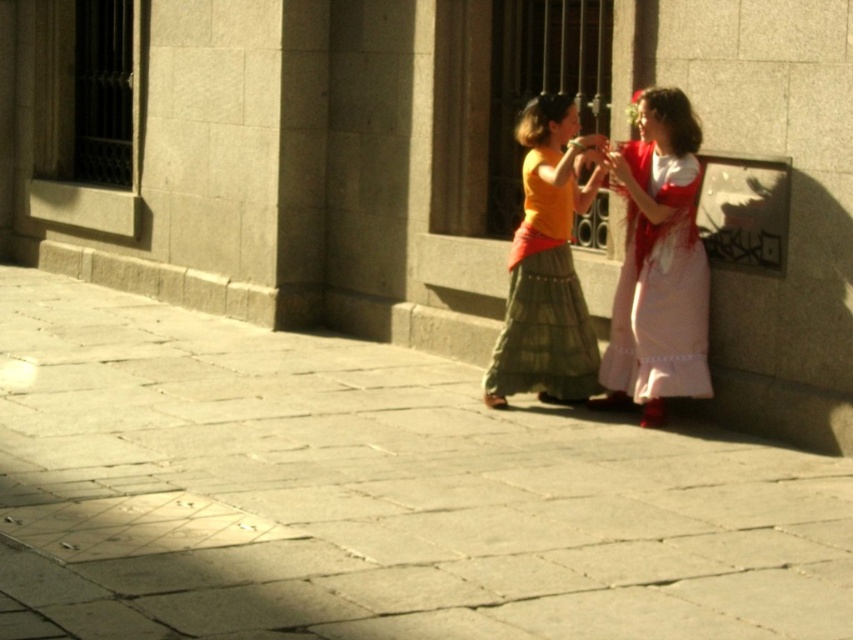
You are a fashion designer observing two outfits in the scene. The first outfit has a matte yellow blouse at center and the second has a silky white flower at upper right. Which clothing item takes up more visual space in the image?

The matte yellow blouse at center takes up more visual space in the image because it is bigger than the silky white flower at upper right.

Consider the image. You are a delivery person trying to place a package on the ground between the smooth stone pavement at center and the matte yellow blouse at center. Can you place it there?

The smooth stone pavement at center is below the matte yellow blouse at center, so the package can be placed on the smooth stone pavement at center between them.

You are standing on the sidewalk in front of the stone building and want to take a photo of the matte yellow blouse at center and the silky white flower at upper right. Which object should you point your camera towards first to capture both in the frame?

You should point your camera towards the silky white flower at upper right first because the matte yellow blouse at center is located below it, ensuring both will be in the frame when starting from the higher position.